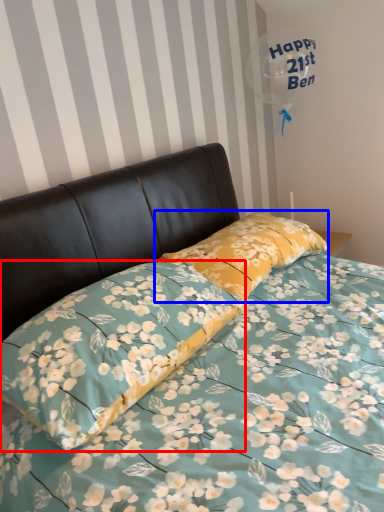
Question: Among these objects, which one is farthest to the camera, pillow (highlighted by a red box) or pillow (highlighted by a blue box)?

Choices:
 (A) pillow
 (B) pillow

Answer: (B)